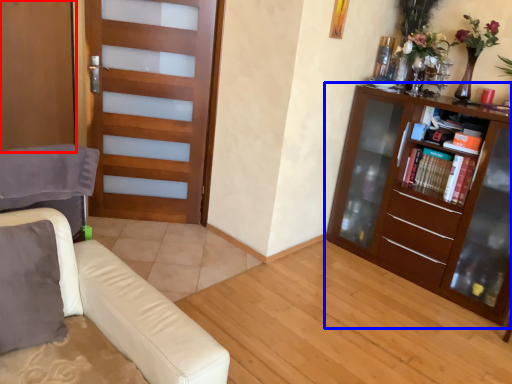
Question: Which object is closer to the camera taking this photo, screen door (highlighted by a red box) or bookcase (highlighted by a blue box)?

Choices:
 (A) screen door
 (B) bookcase

Answer: (B)